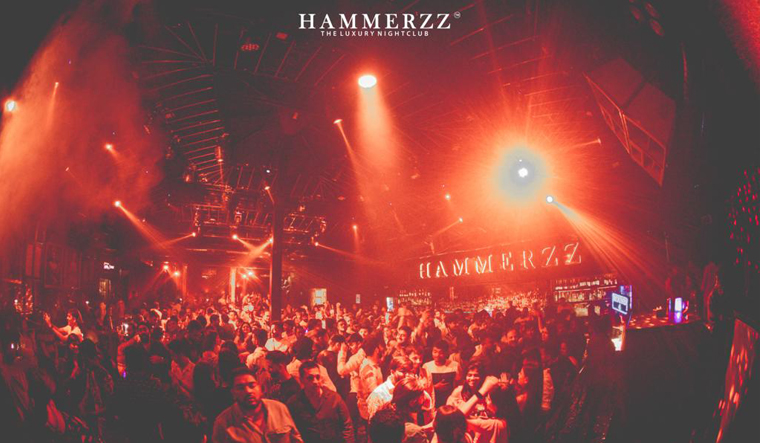
Identify the location of screens. This screenshot has height=443, width=760. (629, 307), (625, 294), (672, 317).